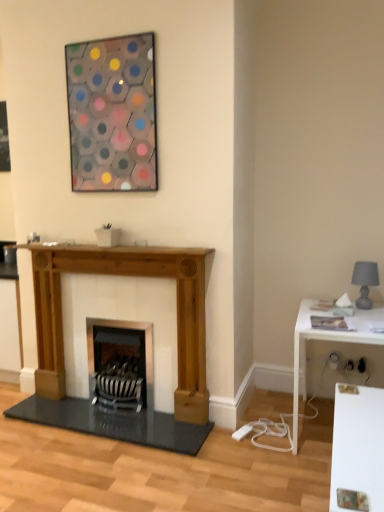
Question: From a real-world perspective, is black metal wood burning stove at center positioned above or below white glossy table at right?

Choices:
 (A) below
 (B) above

Answer: (A)

Question: Is black metal wood burning stove at center taller or shorter than white glossy table at right?

Choices:
 (A) short
 (B) tall

Answer: (A)

Question: Which object is positioned farthest from the gray fabric lampshade at right?

Choices:
 (A) black metal wood burning stove at center
 (B) natural wood fireplace at center
 (C) metallic hexagonal artwork at upper center
 (D) white glossy table at right

Answer: (C)

Question: Which object is the farthest from the white glossy table at right?

Choices:
 (A) metallic hexagonal artwork at upper center
 (B) natural wood fireplace at center
 (C) black metal wood burning stove at center
 (D) gray fabric lampshade at right

Answer: (A)